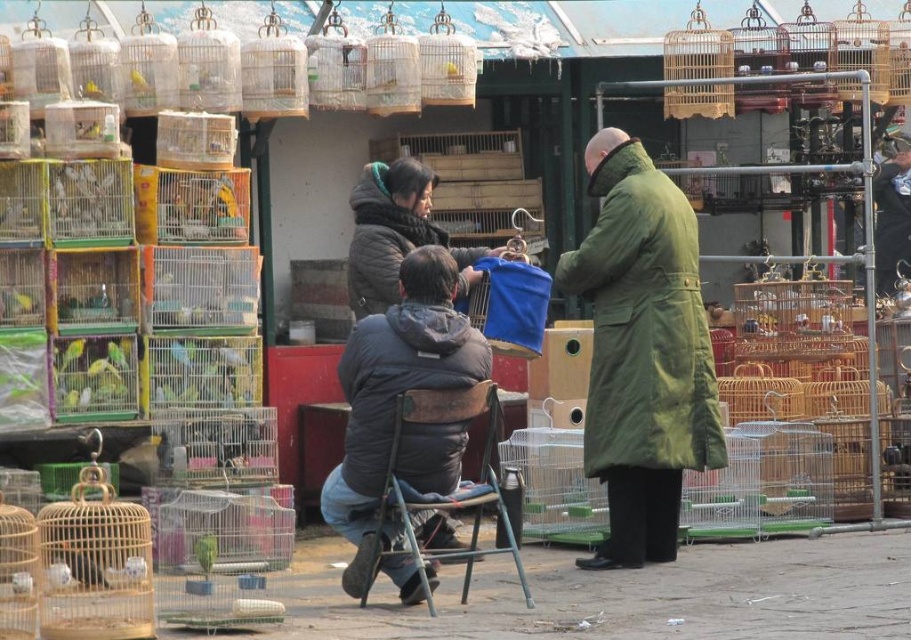
Question: Is dark brown fur coat at center to the right of yellow matte birdcage at upper left from the viewer's perspective?

Choices:
 (A) no
 (B) yes

Answer: (B)

Question: Is dark brown fur coat at center to the left of yellow matte birdcage at upper left from the viewer's perspective?

Choices:
 (A) no
 (B) yes

Answer: (A)

Question: Which point is farther to the camera?

Choices:
 (A) green matte birdcage at center
 (B) yellow matte birdcage at upper left
 (C) dark brown fur coat at center
 (D) green matte coat at center

Answer: (C)

Question: Can you confirm if green matte coat at center is positioned below green matte birdcage at center?

Choices:
 (A) yes
 (B) no

Answer: (B)

Question: Which of the following is the closest to the observer?

Choices:
 (A) (109, 362)
 (B) (141, 77)
 (C) (354, 296)
 (D) (643, 396)

Answer: (A)

Question: Considering the real-world distances, which object is closest to the yellow matte birdcage at upper left?

Choices:
 (A) dark brown fur coat at center
 (B) dark gray fleece jacket at center
 (C) green matte birdcage at center
 (D) green matte coat at center

Answer: (C)